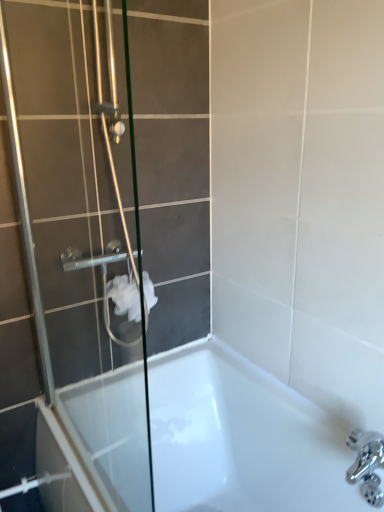
Question: Is clear glass shower door at left taller or shorter than white glossy bathtub at lower center?

Choices:
 (A) short
 (B) tall

Answer: (B)

Question: In the image, is clear glass shower door at left on the left side or the right side of white glossy bathtub at lower center?

Choices:
 (A) left
 (B) right

Answer: (A)

Question: Estimate the real-world distances between objects in this image. Which object is closer to the white glossy bathtub at lower center?

Choices:
 (A) clear glass shower door at left
 (B) white matte toilet paper at center

Answer: (A)

Question: Based on their relative distances, which object is farther from the white matte toilet paper at center?

Choices:
 (A) clear glass shower door at left
 (B) white glossy bathtub at lower center

Answer: (B)